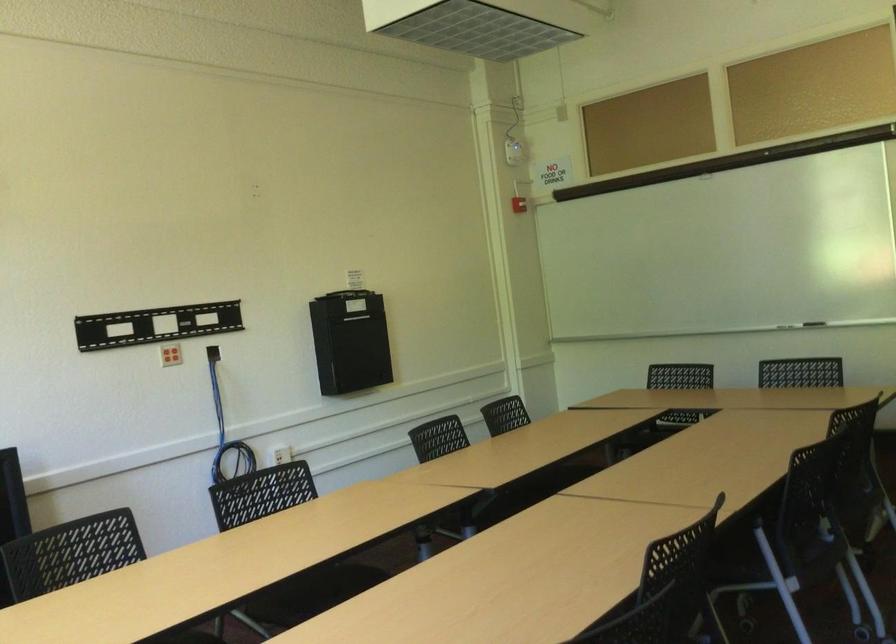
Find where to pull the blue coiled cable. Please return your answer as a coordinate pair (x, y).

(226, 431)